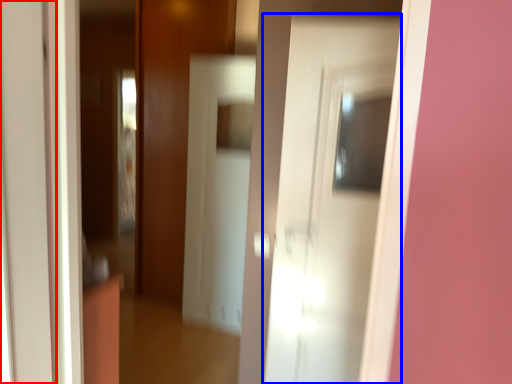
Question: Which point is further to the camera, door (highlighted by a red box) or door (highlighted by a blue box)?

Choices:
 (A) door
 (B) door

Answer: (B)